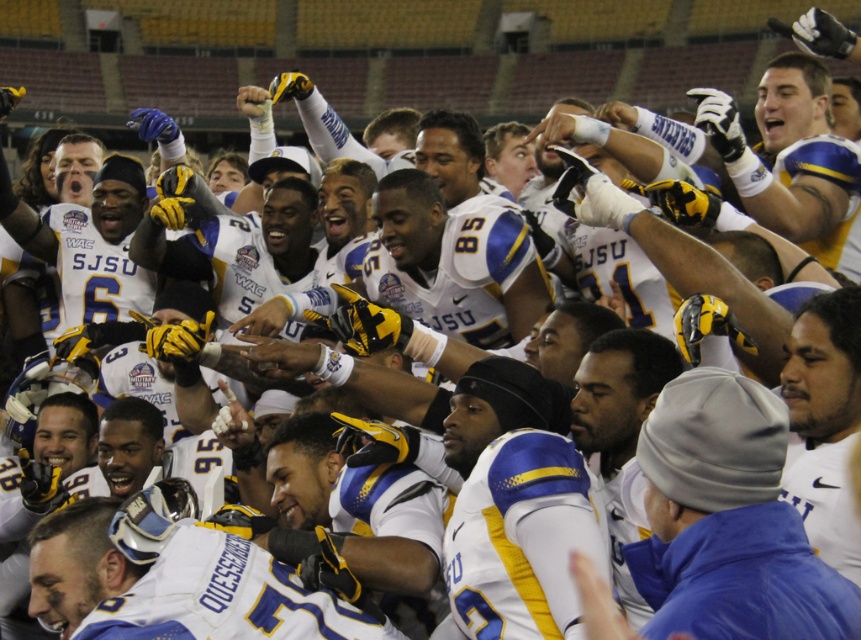
Between white matte jersey at center and matte blue jersey at upper right, which one is positioned lower?

white matte jersey at center is lower down.

Does point (40, 592) come behind point (773, 148)?

No, it is not.

The image size is (861, 640). What are the coordinates of `white matte jersey at center` in the screenshot? It's located at 177,586.